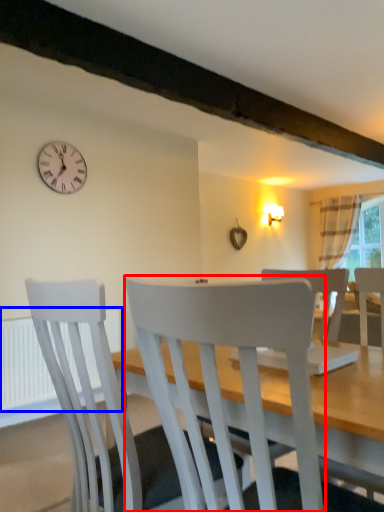
Question: Which object appears closest to the camera in this image, chair (highlighted by a red box) or radiator (highlighted by a blue box)?

Choices:
 (A) chair
 (B) radiator

Answer: (A)